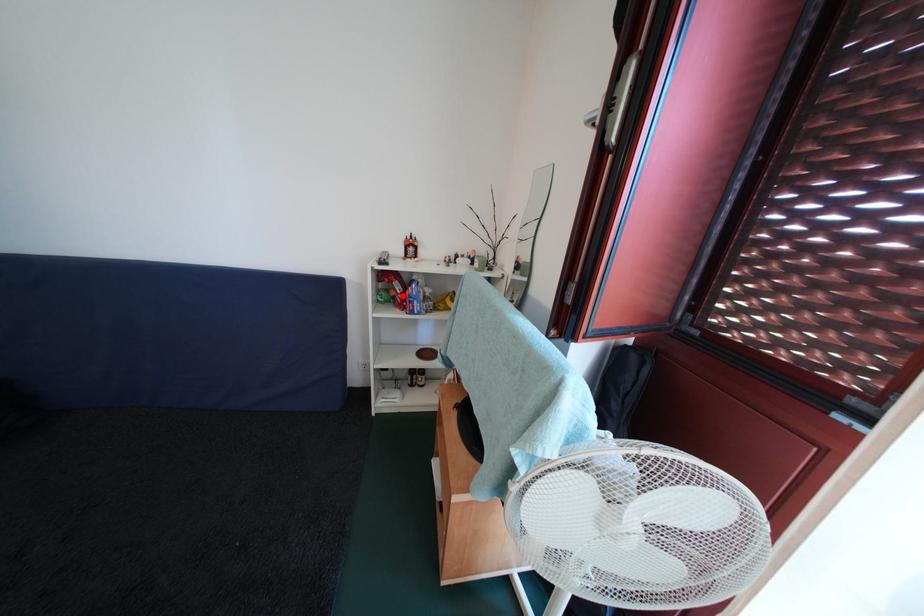
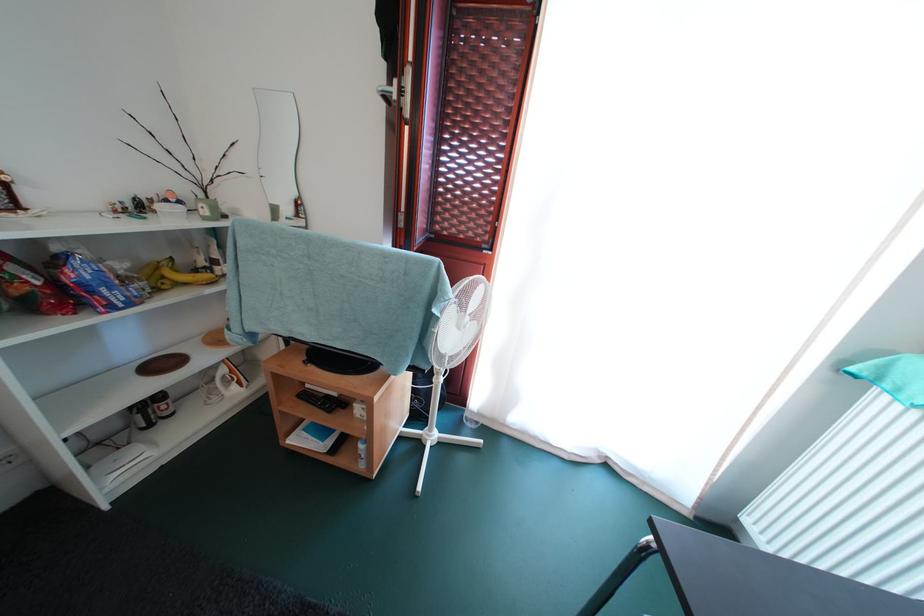
Question: I am providing you with two images of the same scene from different viewpoints. In image1, a red point is highlighted. Considering the same 3D point in image2, which of the following is correct?

Choices:
 (A) It is closer
 (B) It is farther

Answer: (B)